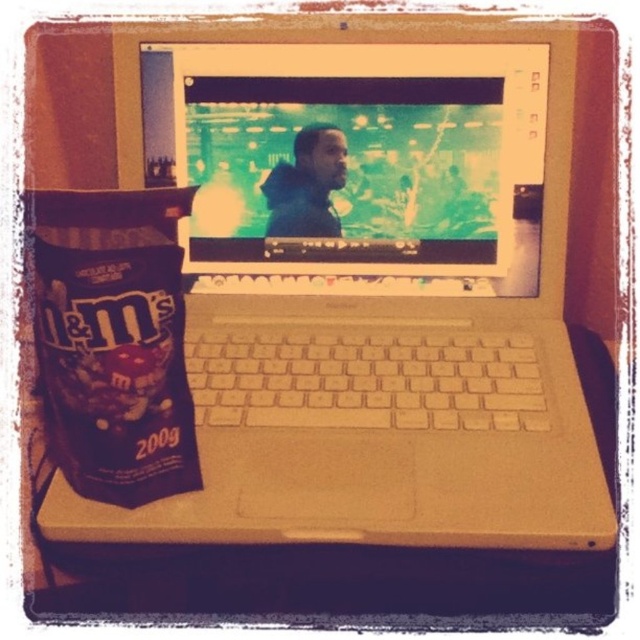
Question: Is dark purple matte m&m's bag at left behind matte plastic table at lower center?

Choices:
 (A) no
 (B) yes

Answer: (A)

Question: Can you confirm if dark purple matte m&m's bag at left is positioned to the left of matte plastic table at lower center?

Choices:
 (A) no
 (B) yes

Answer: (B)

Question: Can you confirm if dark purple matte m&m's bag at left is smaller than matte plastic table at lower center?

Choices:
 (A) no
 (B) yes

Answer: (B)